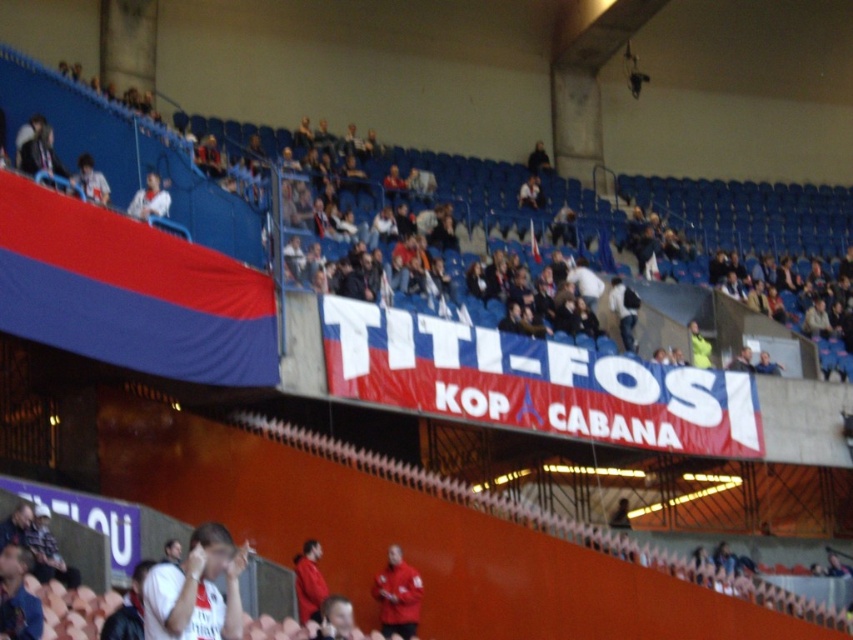
Question: Which object appears closest to the camera in this image?

Choices:
 (A) matte red jacket at center
 (B) white fabric shirt at upper left
 (C) red matte jacket at center

Answer: (A)

Question: Which point is closer to the camera?

Choices:
 (A) matte red jacket at center
 (B) white fabric shirt at upper left

Answer: (A)

Question: Is white matte shirt at center closer to the viewer compared to red matte jacket at center?

Choices:
 (A) no
 (B) yes

Answer: (B)

Question: Does white matte shirt at center appear over matte red jacket at center?

Choices:
 (A) no
 (B) yes

Answer: (B)

Question: Does red matte jacket at center appear over white fabric shirt at upper left?

Choices:
 (A) yes
 (B) no

Answer: (B)

Question: Which of these objects is positioned closest to the red matte jacket at center?

Choices:
 (A) matte red jacket at center
 (B) white fabric shirt at upper left

Answer: (A)